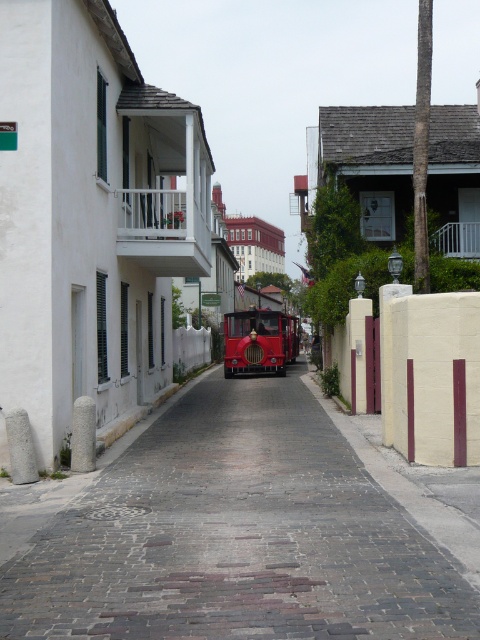
Question: Can you confirm if smooth cobblestone alley at center is wider than shiny red trolley at center?

Choices:
 (A) yes
 (B) no

Answer: (A)

Question: Which of the following is the farthest from the observer?

Choices:
 (A) (241, 320)
 (B) (36, 506)

Answer: (A)

Question: Which point is farther to the camera?

Choices:
 (A) smooth cobblestone alley at center
 (B) shiny red trolley at center

Answer: (B)

Question: Can you confirm if smooth cobblestone alley at center is wider than shiny red trolley at center?

Choices:
 (A) yes
 (B) no

Answer: (A)

Question: Which point is farther from the camera taking this photo?

Choices:
 (A) pyautogui.click(x=267, y=316)
 (B) pyautogui.click(x=110, y=552)

Answer: (A)

Question: Does smooth cobblestone alley at center appear on the right side of shiny red trolley at center?

Choices:
 (A) yes
 (B) no

Answer: (B)